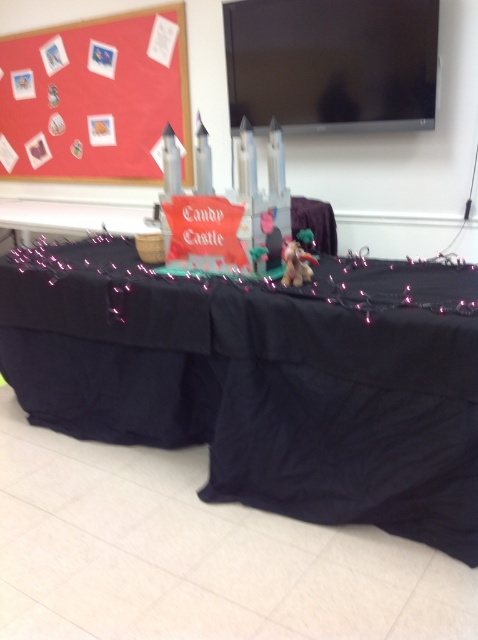
Does black fabric table at center have a larger size compared to red matte bulletin board at upper left?

Indeed, black fabric table at center has a larger size compared to red matte bulletin board at upper left.

What do you see at coordinates (263, 380) in the screenshot? The width and height of the screenshot is (478, 640). I see `black fabric table at center` at bounding box center [263, 380].

You are a GUI agent. You are given a task and a screenshot of the screen. Output one action in this format:
    pyautogui.click(x=<x>, y=<y>)
    Task: Click on the black fabric table at center
    
    Given the screenshot: What is the action you would take?
    pyautogui.click(x=263, y=380)

What are the coordinates of `black fabric table at center` in the screenshot? It's located at (263, 380).

Does point (69, 104) come farther from viewer compared to point (307, 266)?

Yes, it is behind point (307, 266).

Which is in front, point (110, 160) or point (315, 259)?

Positioned in front is point (315, 259).

This screenshot has width=478, height=640. What do you see at coordinates (95, 97) in the screenshot?
I see `red matte bulletin board at upper left` at bounding box center [95, 97].

The image size is (478, 640). Find the location of `red matte bulletin board at upper left`. red matte bulletin board at upper left is located at coordinates click(95, 97).

Is black fabric table at center taller than satin gold unicorn at center?

Yes.

Is black fabric table at center thinner than satin gold unicorn at center?

In fact, black fabric table at center might be wider than satin gold unicorn at center.

Is point (49, 300) positioned in front of point (302, 266)?

That is False.

Find the location of a particular element. Image resolution: width=478 pixels, height=640 pixels. black fabric table at center is located at coordinates (263, 380).